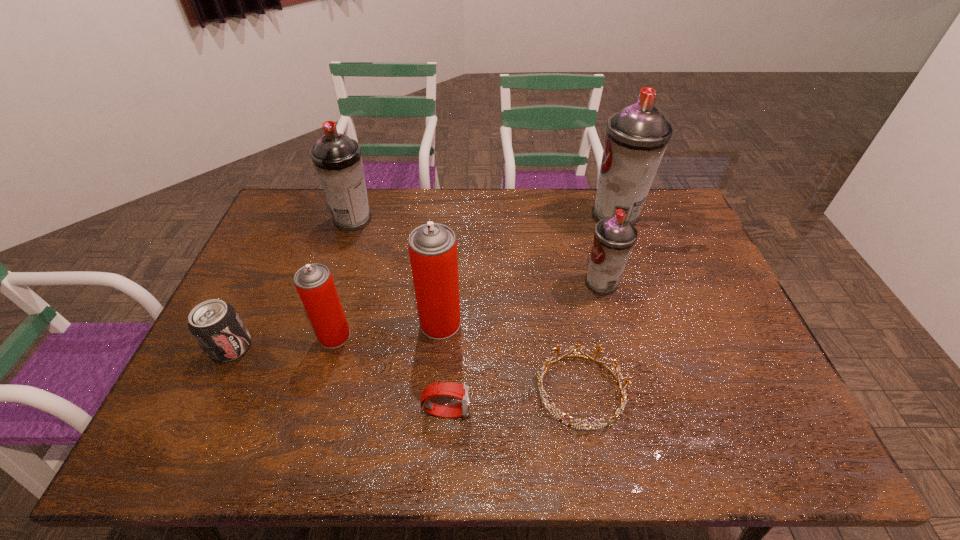
In order to click on red watch in this screenshot , I will do `click(460, 391)`.

The width and height of the screenshot is (960, 540). I want to click on watch, so click(x=460, y=391).

Where is `tiara`? The height and width of the screenshot is (540, 960). tiara is located at coordinates (540, 379).

Identify the location of vacant space located 0.070m on the back of the tallest object. (607, 188).

Where is `free point located 0.320m on the front of the leftmost gray aerosol can`? This screenshot has width=960, height=540. free point located 0.320m on the front of the leftmost gray aerosol can is located at coordinates (325, 305).

This screenshot has height=540, width=960. Identify the location of free space located on the front of the third aerosol can from right to left. (435, 393).

The image size is (960, 540). In order to click on vacant area located on the back of the smaller red aerosol can in this screenshot , I will do `click(348, 287)`.

What are the coordinates of `free space located on the left of the sixth nearest object` in the screenshot? It's located at (546, 283).

Locate an element on the screen. This screenshot has height=540, width=960. blank space located on the right of the soda can is located at coordinates (333, 347).

I want to click on vacant point located on the face of the second shortest object, so click(x=545, y=411).